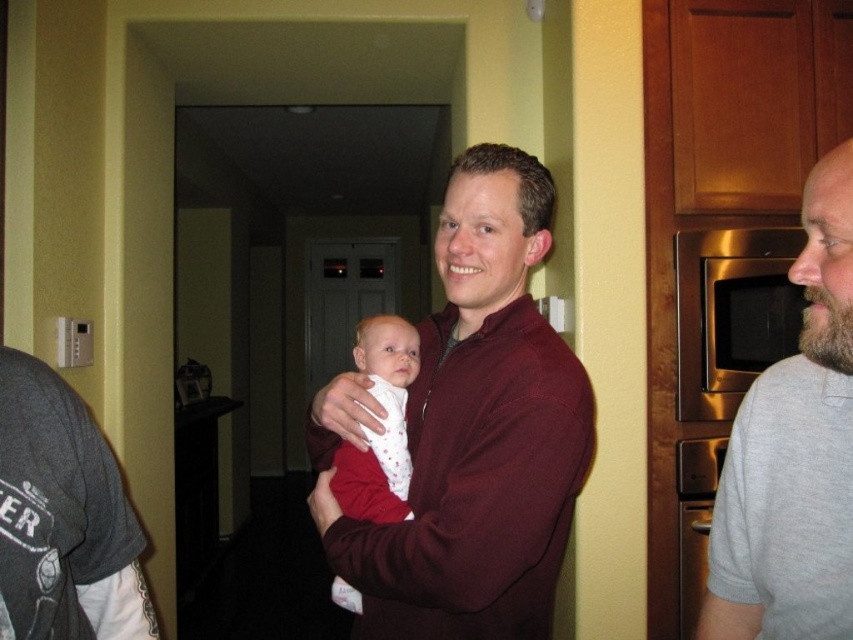
Does maroon sweater at center have a lesser height compared to gray cotton shirt at right?

Incorrect, maroon sweater at center's height does not fall short of gray cotton shirt at right's.

Who is more forward, (520, 250) or (769, 632)?

Point (769, 632) is in front.

Between point (459, 460) and point (828, 160), which one is positioned behind?

Positioned behind is point (459, 460).

What are the coordinates of `maroon sweater at center` in the screenshot? It's located at (479, 432).

Does dark gray t-shirt at left appear under white soft baby at center?

Yes, dark gray t-shirt at left is below white soft baby at center.

Is dark gray t-shirt at left positioned at the back of white soft baby at center?

No, dark gray t-shirt at left is in front of white soft baby at center.

Does point (146, 637) come behind point (392, 380)?

That is False.

At what (x,y) coordinates should I click in order to perform the action: click on dark gray t-shirt at left. Please return your answer as a coordinate pair (x, y). Looking at the image, I should click on (62, 516).

From the picture: Does maroon sweater at center appear on the right side of gray cotton arm at right?

Answer: No, maroon sweater at center is not to the right of gray cotton arm at right.

Can you confirm if maroon sweater at center is shorter than gray cotton arm at right?

Incorrect, maroon sweater at center's height does not fall short of gray cotton arm at right's.

Locate an element on the screen. The height and width of the screenshot is (640, 853). maroon sweater at center is located at coordinates (479, 432).